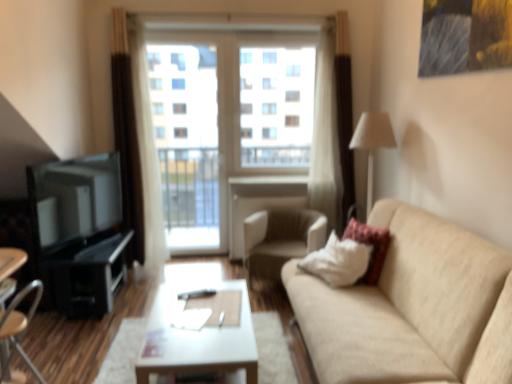
The width and height of the screenshot is (512, 384). Find the location of `free spot to the right of transparent glass screen door at center`. free spot to the right of transparent glass screen door at center is located at coordinates (205, 263).